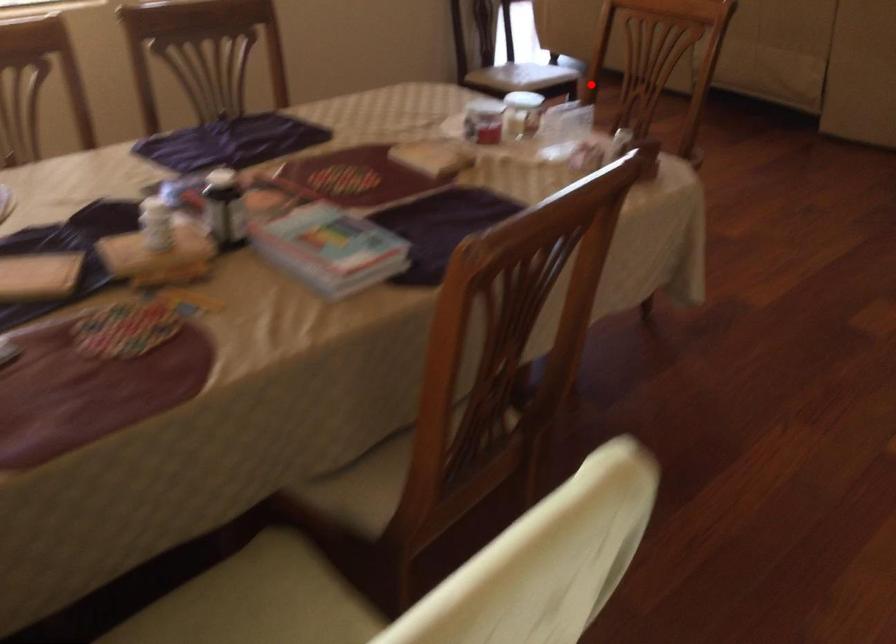
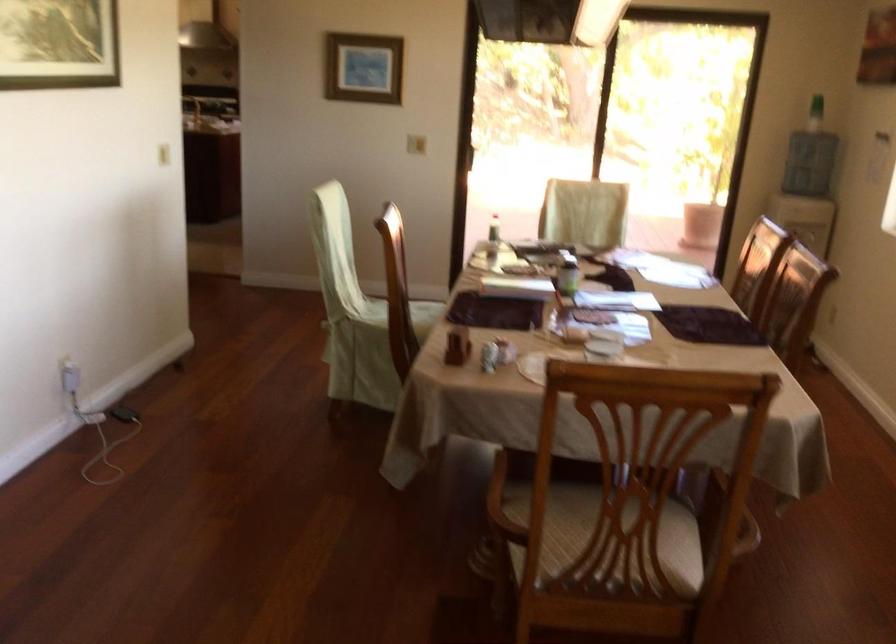
Question: I am providing you with two images of the same scene from different viewpoints. Image1 has a red point marked. In image2, the corresponding 3D location appears at what relative position? Reply with the corresponding letter.

Choices:
 (A) Closer
 (B) Farther

Answer: (A)